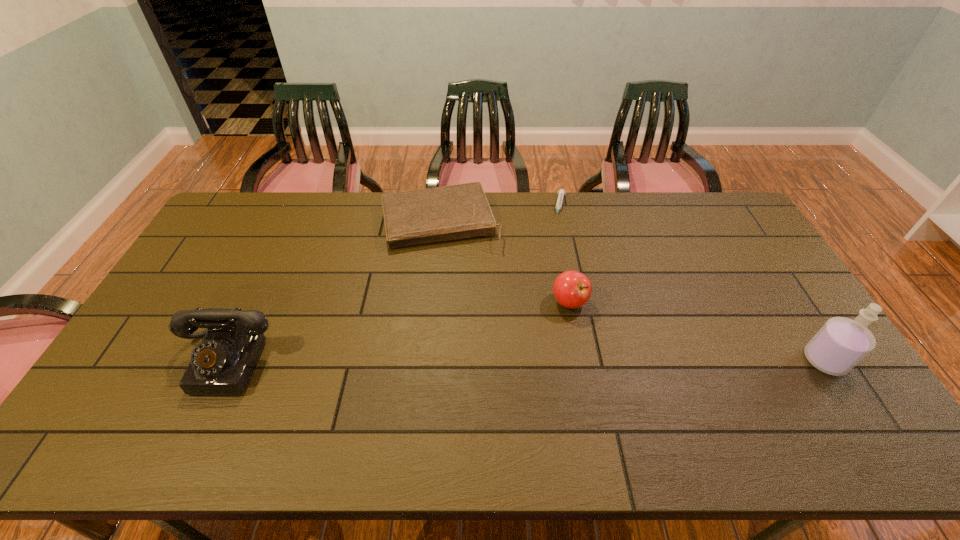
Locate which object is the second closest to the second shortest object. Please provide its 2D coordinates. Your answer should be formatted as a tuple, i.e. [(x, y)], where the tuple contains the x and y coordinates of a point satisfying the conditions above.

[(572, 289)]

The image size is (960, 540). I want to click on free spot that satisfies the following two spatial constraints: 1. on the back side of the paperback book; 2. on the left side of the shortest object, so click(442, 206).

I want to click on vacant space that satisfies the following two spatial constraints: 1. on the front side of the tallest object; 2. on the left side of the second object from left to right, so click(x=426, y=360).

Where is `free spot that satisfies the following two spatial constraints: 1. on the front side of the perfume; 2. on the right side of the shortest object`? The image size is (960, 540). free spot that satisfies the following two spatial constraints: 1. on the front side of the perfume; 2. on the right side of the shortest object is located at coordinates (592, 360).